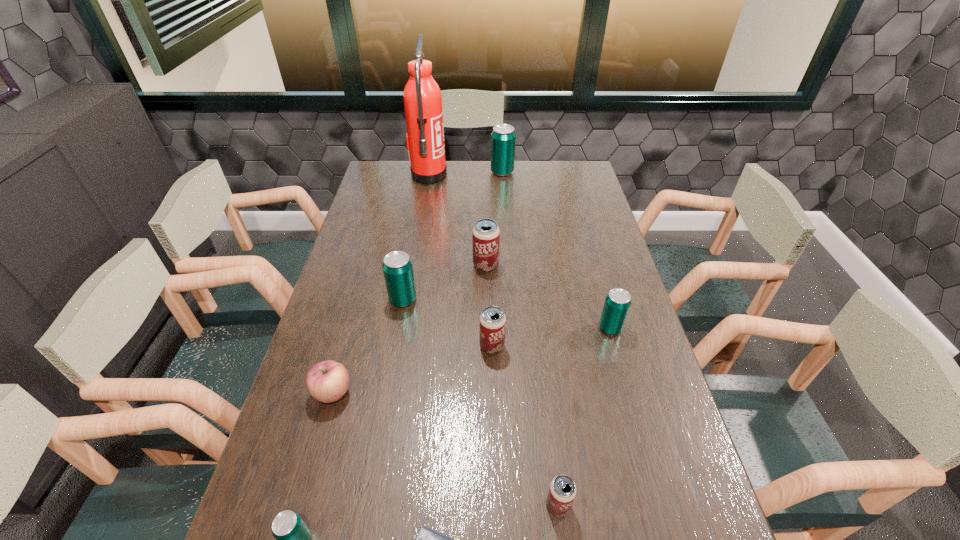
You are a GUI agent. You are given a task and a screenshot of the screen. Output one action in this format:
    pyautogui.click(x=<x>, y=<y>)
    Task: Click on the vacant space located on the back of the nearest red beer can
    
    Given the screenshot: What is the action you would take?
    pyautogui.click(x=540, y=349)

The height and width of the screenshot is (540, 960). I want to click on fire extinguisher at the far edge, so click(422, 98).

Find the location of `beer can present at the far edge`. beer can present at the far edge is located at coordinates (503, 138).

The width and height of the screenshot is (960, 540). In order to click on object that is at the left edge in this screenshot , I will do `click(327, 381)`.

Locate an element on the screen. This screenshot has width=960, height=540. object situated at the right edge is located at coordinates click(617, 303).

This screenshot has height=540, width=960. Identify the location of vacant space at the far edge of the desktop. (468, 177).

This screenshot has width=960, height=540. In order to click on vacant space at the left edge of the desktop in this screenshot , I will do `click(281, 484)`.

This screenshot has width=960, height=540. I want to click on vacant space at the right edge of the desktop, so click(x=602, y=216).

I want to click on vacant space at the far left corner of the desktop, so click(389, 168).

What are the coordinates of `vacant position at the far right corner of the desktop` in the screenshot? It's located at (554, 187).